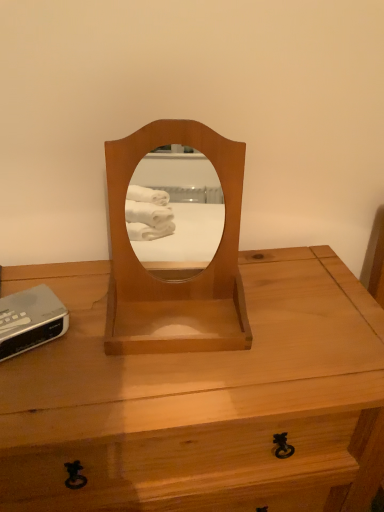
The width and height of the screenshot is (384, 512). I want to click on vacant area that lies between silver plastic clock at lower left and light brown wood mirror at center, so click(81, 334).